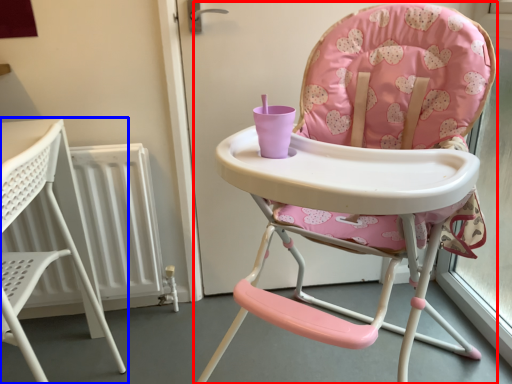
Question: Which of the following is the farthest to the observer, chair (highlighted by a red box) or chair (highlighted by a blue box)?

Choices:
 (A) chair
 (B) chair

Answer: (B)